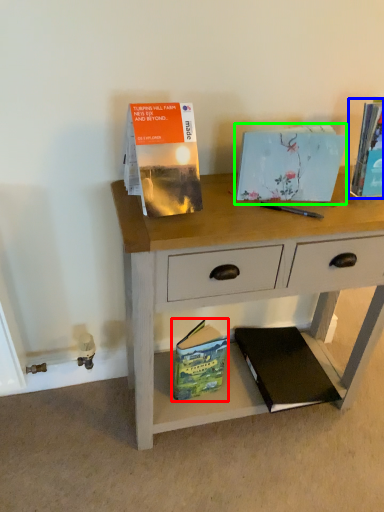
Question: Estimate the real-world distances between objects in this image. Which object is farther from paperback book (highlighted by a red box), paperback book (highlighted by a blue box) or paperback book (highlighted by a green box)?

Choices:
 (A) paperback book
 (B) paperback book

Answer: (A)